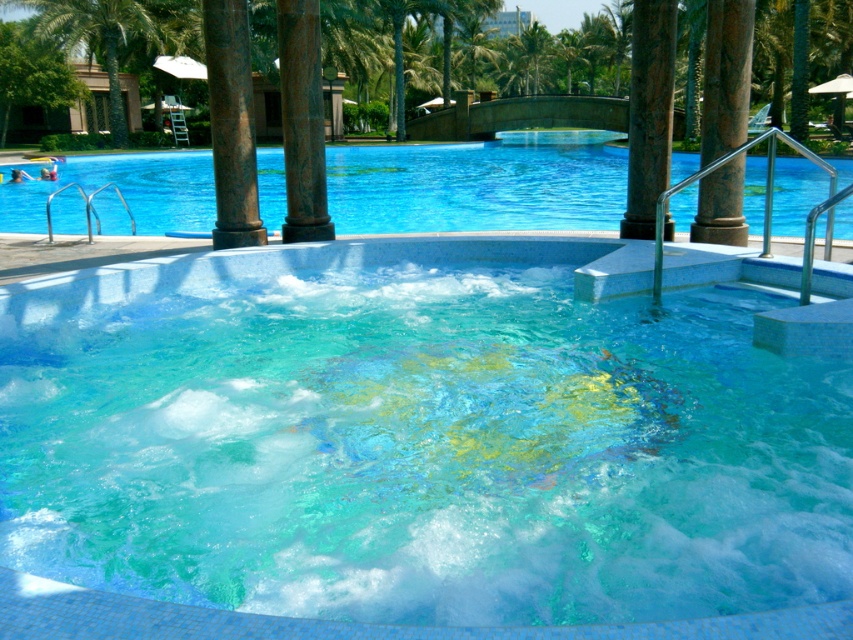
You are standing at the edge of the pool and want to reach both points in the water. Which point, point (312, 42) or point (117, 131), is closer to you?

Point (312, 42) is closer to the viewer than point (117, 131), so you should reach for point (312, 42) first.

You are a drone operator tasked with capturing aerial footage of the green marble pillar at center and the green leafy palm tree at upper left. The drone has a maximum flight range of 30 meters. Can the drone safely capture footage of both objects without exceeding its range?

The green marble pillar at center is 31.46 meters away from the green leafy palm tree at upper left. Since the distance between them exceeds the drone s 30 meter range, the drone cannot safely capture footage of both objects without exceeding its range.